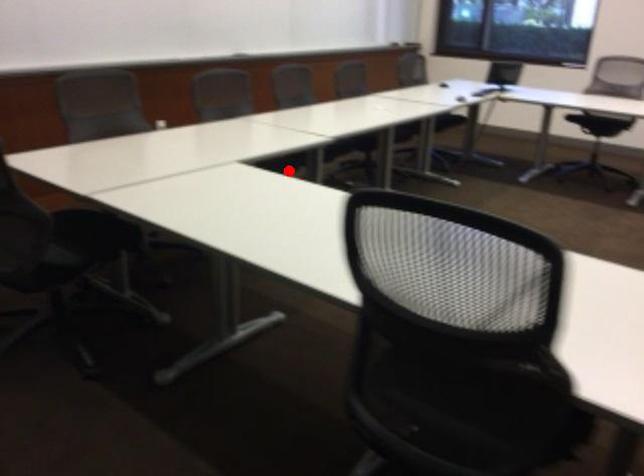
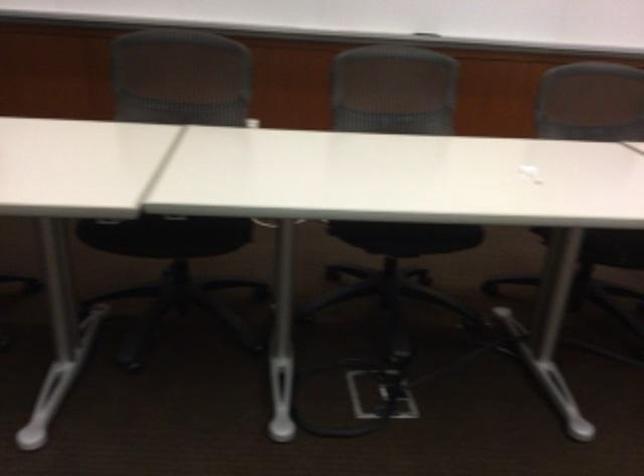
In the second image, find the point that corresponds to the highlighted location in the first image.

(166, 235)